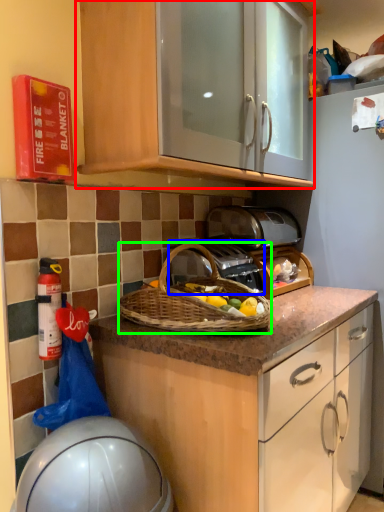
Question: Which object is positioned closest to cabinetry (highlighted by a red box)? Select from gas stove (highlighted by a blue box) and picnic basket (highlighted by a green box).

Choices:
 (A) gas stove
 (B) picnic basket

Answer: (B)